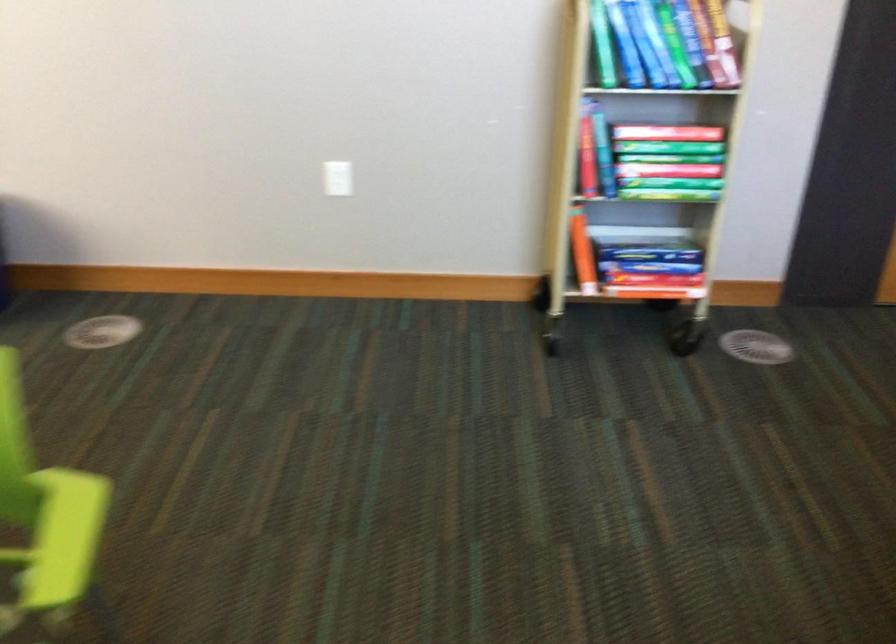
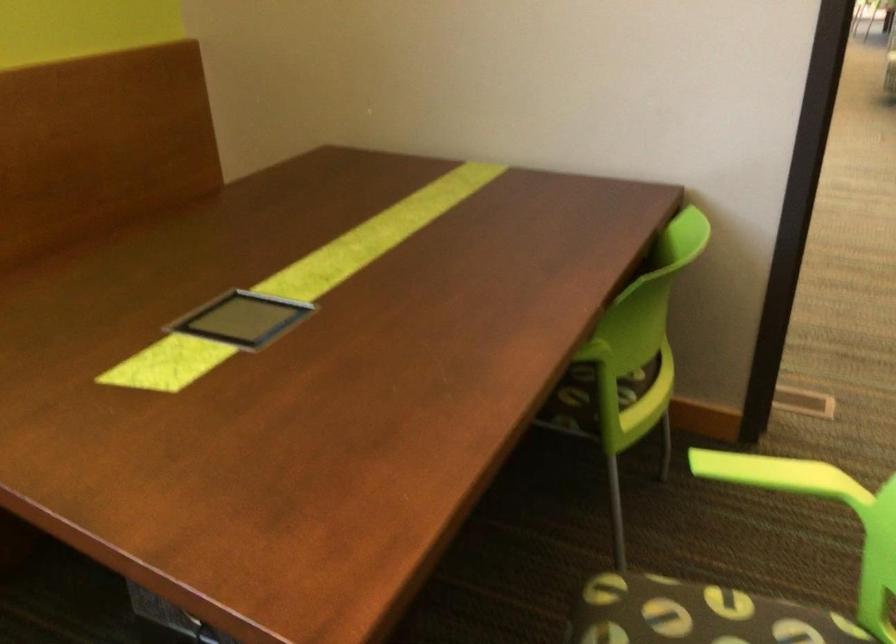
The first image is from the beginning of the video and the second image is from the end. How did the camera likely rotate when shooting the video?

The camera rotated toward left-down.